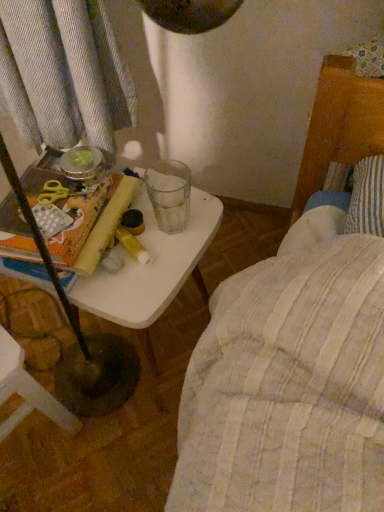
Find the location of a particular element. empty space that is ontop of white plastic table at center (from a real-world perspective) is located at coordinates (148, 237).